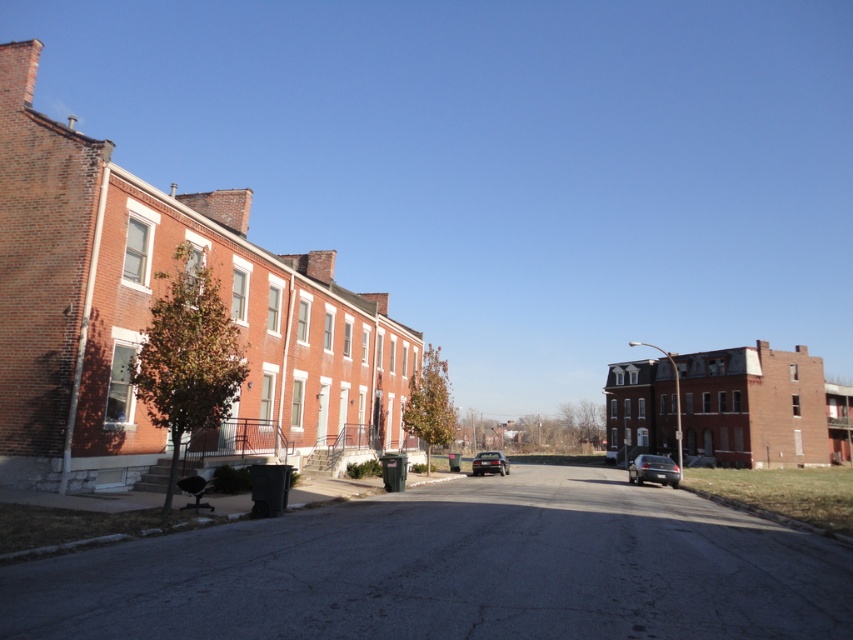
Question: Which point is closer to the camera?

Choices:
 (A) (502, 472)
 (B) (666, 476)

Answer: (B)

Question: Observing the image, what is the correct spatial positioning of satin silver sedan at center-right in reference to shiny black sedan at center?

Choices:
 (A) left
 (B) right

Answer: (B)

Question: Among these points, which one is farthest from the camera?

Choices:
 (A) click(x=639, y=477)
 (B) click(x=490, y=456)

Answer: (B)

Question: Does satin silver sedan at center-right come behind shiny black sedan at center?

Choices:
 (A) no
 (B) yes

Answer: (A)

Question: Does satin silver sedan at center-right appear on the right side of shiny black sedan at center?

Choices:
 (A) yes
 (B) no

Answer: (A)

Question: Which point is closer to the camera taking this photo?

Choices:
 (A) (486, 452)
 (B) (664, 460)

Answer: (B)